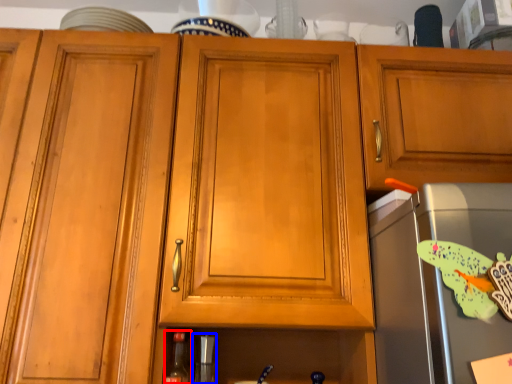
Question: Which object appears farthest to the camera in this image, bottle (highlighted by a red box) or appliance (highlighted by a blue box)?

Choices:
 (A) bottle
 (B) appliance

Answer: (B)